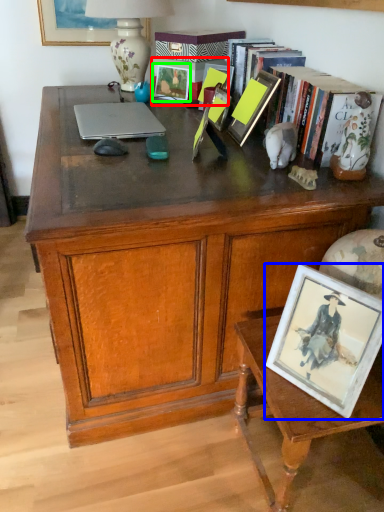
Question: Considering the real-world distances, which object is farthest from picture frame (highlighted by a red box)? picture frame (highlighted by a blue box) or picture frame (highlighted by a green box)?

Choices:
 (A) picture frame
 (B) picture frame

Answer: (A)